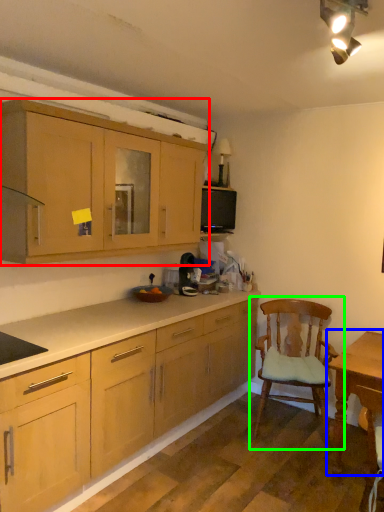
Question: Which is nearer to the cabinetry (highlighted by a red box)? table (highlighted by a blue box) or chair (highlighted by a green box).

Choices:
 (A) table
 (B) chair

Answer: (B)